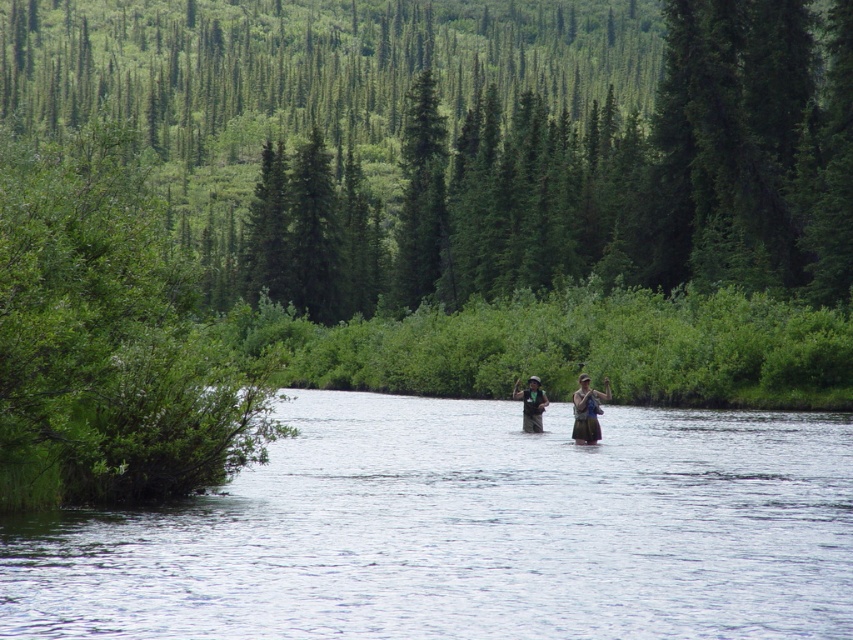
You are standing at the point with coordinates point (582, 397) and want to move to the point with coordinates point (567, 428). Is the destination point in front of or behind you?

The point (567, 428) is behind point (582, 397), so the destination point is behind you.

You are a hiker who wants to cross the clear water at center while wearing the brown fabric jacket at center. Can you cross the water without getting your jacket wet?

The clear water at center is shorter than brown fabric jacket at center, so the water won not reach the jacket. You can cross the clear water at center without getting the brown fabric jacket at center wet.